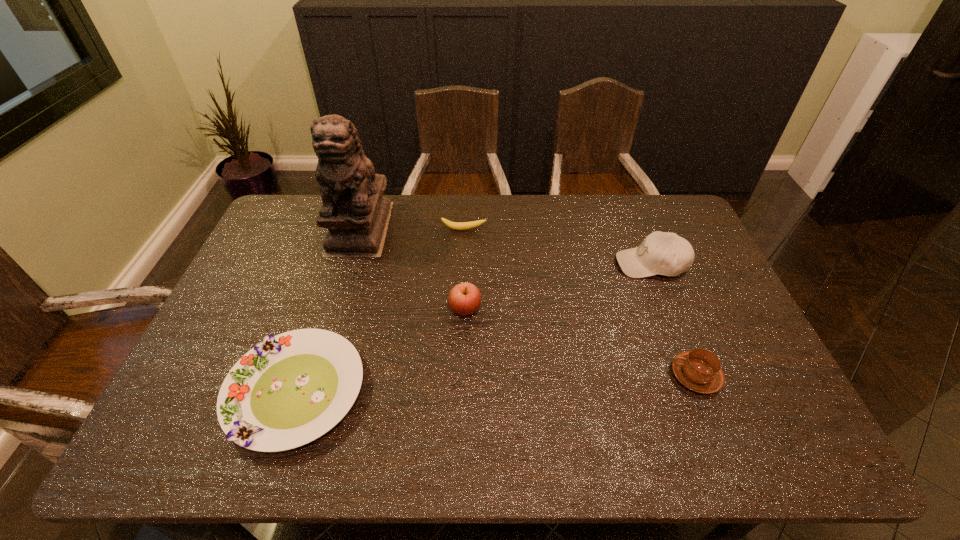
This screenshot has width=960, height=540. In order to click on vacant space located on the front-facing side of the second tallest object in this screenshot , I will do `click(582, 264)`.

Locate an element on the screen. free location located 0.080m on the front of the third nearest object is located at coordinates (464, 345).

Locate an element on the screen. This screenshot has width=960, height=540. vacant space positioned on the side of the fourth tallest object with the handle is located at coordinates (573, 375).

At what (x,y) coordinates should I click in order to perform the action: click on free space located on the side of the fourth tallest object with the handle. Please return your answer as a coordinate pair (x, y). This screenshot has width=960, height=540. Looking at the image, I should click on (573, 375).

Where is `free region located 0.100m on the side of the fourth tallest object with the handle`? Image resolution: width=960 pixels, height=540 pixels. free region located 0.100m on the side of the fourth tallest object with the handle is located at coordinates (632, 375).

Where is `free location located 0.160m on the upward curve of the banana`? free location located 0.160m on the upward curve of the banana is located at coordinates (462, 263).

Identify the location of vacant space located on the left of the salad plate. (201, 392).

In order to click on sculpture present at the far edge in this screenshot , I will do (x=355, y=212).

Image resolution: width=960 pixels, height=540 pixels. In order to click on banana that is at the far edge in this screenshot , I will do `click(453, 225)`.

Locate an element on the screen. The height and width of the screenshot is (540, 960). object located in the near edge section of the desktop is located at coordinates (x=289, y=390).